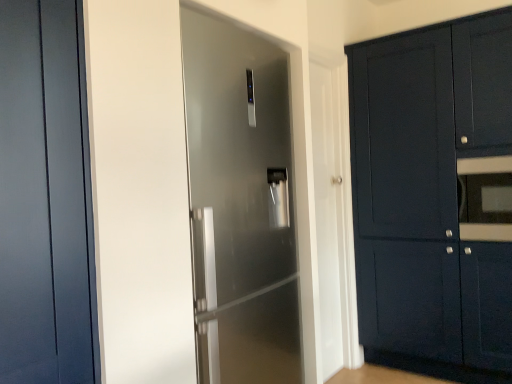
Question: Visually, is satin silver refrigerator at center, acting as the second door starting from the front, positioned to the left or to the right of matte dark blue door at left, the 1th door from the left?

Choices:
 (A) right
 (B) left

Answer: (A)

Question: Is satin silver refrigerator at center, which appears as the 2th door when viewed from the left, wider or thinner than matte dark blue door at left, which is counted as the 2th door, starting from the right?

Choices:
 (A) thin
 (B) wide

Answer: (B)

Question: Estimate the real-world distances between objects in this image. Which object is farther from the matte black oven at right?

Choices:
 (A) matte dark blue cabinet at right
 (B) matte dark blue door at left, the 1th door from the left
 (C) satin silver refrigerator at center, which appears as the 2th door when viewed from the left

Answer: (B)

Question: Which object is the farthest from the matte dark blue cabinet at right?

Choices:
 (A) satin silver refrigerator at center, which appears as the 2th door when viewed from the left
 (B) matte black oven at right
 (C) matte dark blue door at left, the second door when ordered from back to front

Answer: (C)